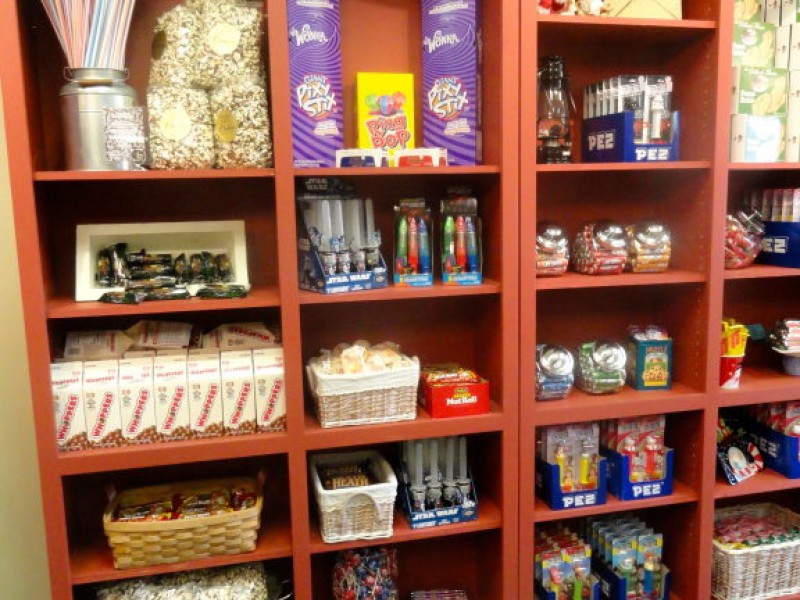
The image size is (800, 600). Identify the location of woven basket. (384, 401), (358, 535), (229, 528), (762, 565).